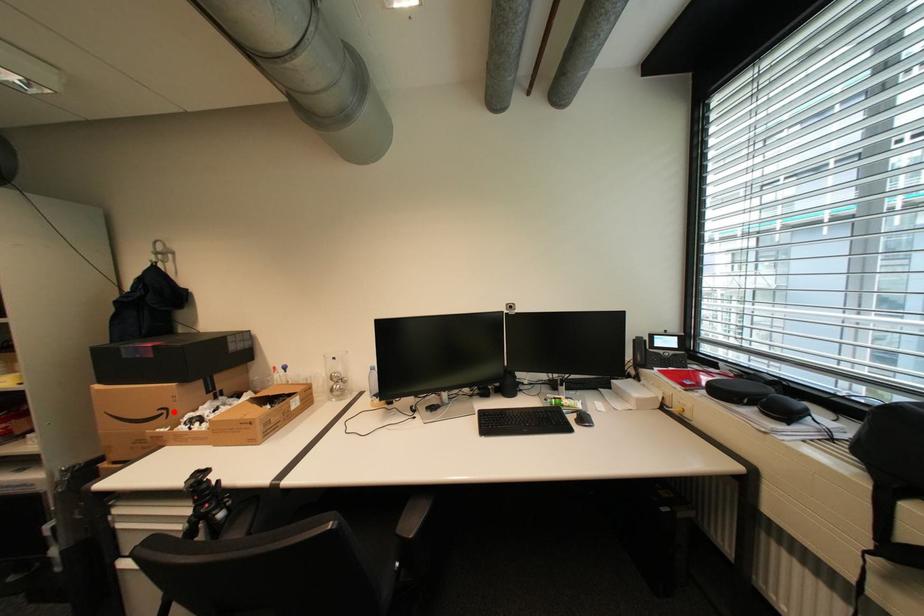
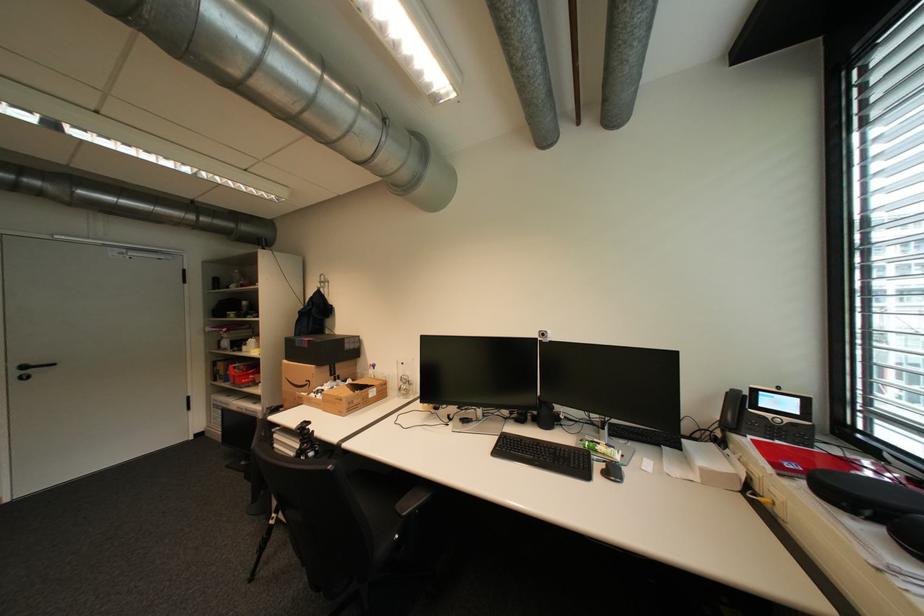
Question: I am providing you with two images of the same scene from different viewpoints. Given a red point in image1, look at the same physical point in image2. Is it:

Choices:
 (A) Closer to the viewpoint
 (B) Farther from the viewpoint

Answer: (B)